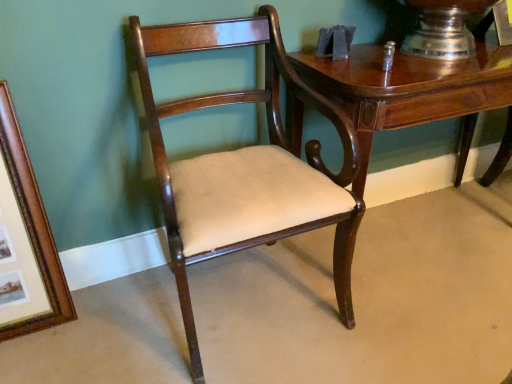
Identify the location of vacant area that is situated to the right of mahogany wood chair at center. (415, 327).